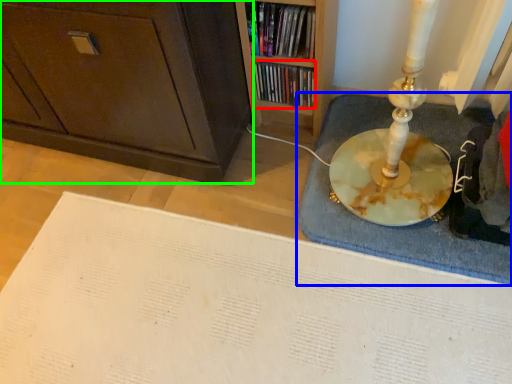
Question: Which object is positioned farthest from book (highlighted by a red box)? Select from bath mat (highlighted by a blue box) and cabinetry (highlighted by a green box).

Choices:
 (A) bath mat
 (B) cabinetry

Answer: (B)